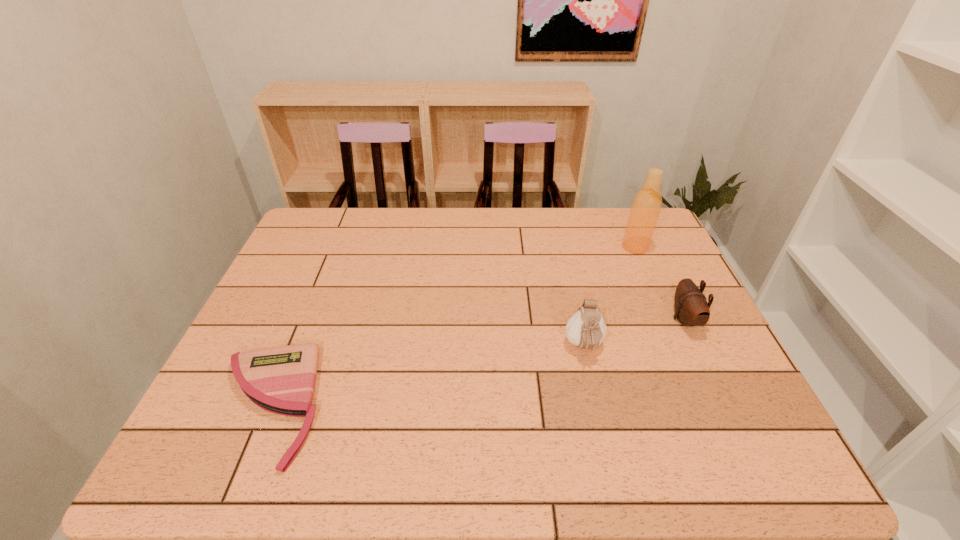
Find the location of a particular element. blank region between the shortest object and the farthest object is located at coordinates (451, 326).

What are the coordinates of `free space between the left pouch and the wristlet` in the screenshot? It's located at (425, 376).

What are the coordinates of `free space between the shorter pouch and the left pouch` in the screenshot? It's located at (635, 333).

Choose which object is the third nearest neighbor to the leftmost object. Please provide its 2D coordinates. Your answer should be formatted as a tuple, i.e. [(x, y)], where the tuple contains the x and y coordinates of a point satisfying the conditions above.

[(646, 206)]

Select which object appears as the third closest to the right pouch. Please provide its 2D coordinates. Your answer should be formatted as a tuple, i.e. [(x, y)], where the tuple contains the x and y coordinates of a point satisfying the conditions above.

[(281, 380)]

Find the location of a particular element. Image resolution: width=960 pixels, height=540 pixels. vacant region that satisfies the following two spatial constraints: 1. with the flap open on the shorter pouch; 2. on the front-facing side of the left pouch is located at coordinates (698, 347).

Identify the location of vacant point that satisfies the following two spatial constraints: 1. with the flap open on the second shortest object; 2. on the front-facing side of the third object from right to left. This screenshot has width=960, height=540. (698, 347).